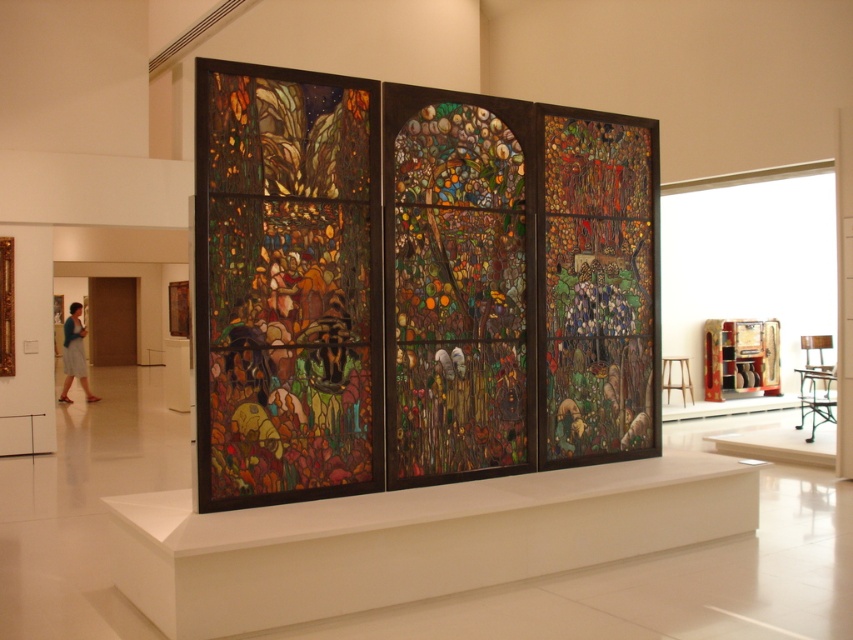
Is stained glass at center taller than stained glass window at center?

No, stained glass at center is not taller than stained glass window at center.

Looking at this image, is stained glass at center below stained glass window at center?

Indeed, stained glass at center is positioned under stained glass window at center.

This screenshot has height=640, width=853. I want to click on stained glass at center, so click(415, 285).

From the picture: Which of these two, stained glass at center or blue denim skirt at left, stands taller?

stained glass at center is taller.

Is point (506, 416) in front of point (62, 337)?

Yes, it is.

I want to click on stained glass at center, so click(415, 285).

Is stained glass window at center taller than blue denim skirt at left?

Yes, stained glass window at center is taller than blue denim skirt at left.

Which is below, stained glass window at center or blue denim skirt at left?

blue denim skirt at left is lower down.

Where is `stained glass window at center`? Image resolution: width=853 pixels, height=640 pixels. stained glass window at center is located at coordinates (456, 285).